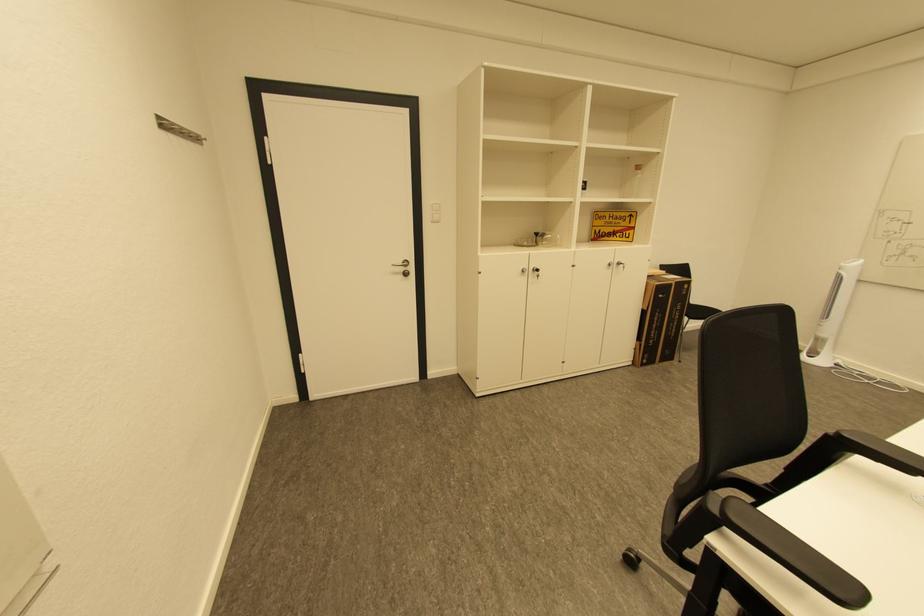
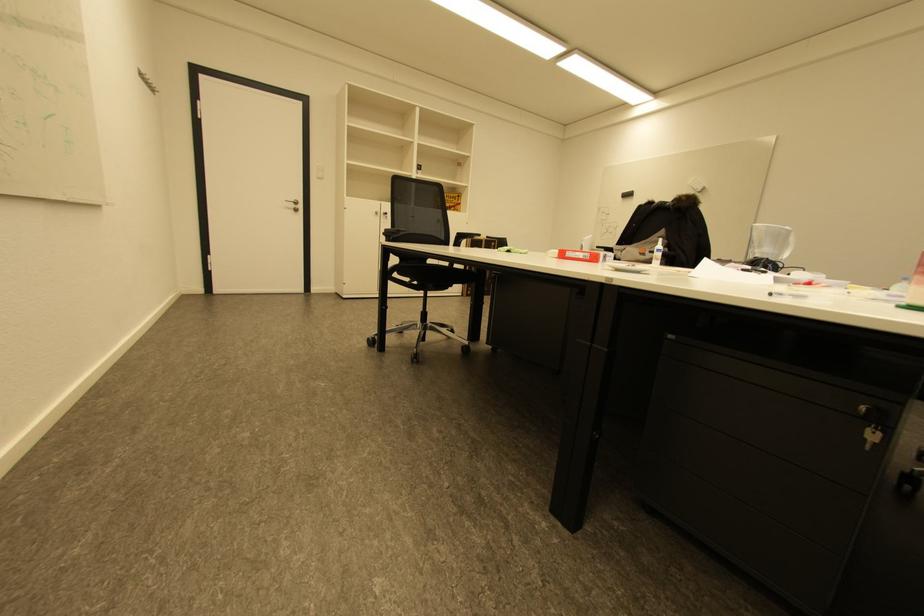
In the scene shown: What movement of the cameraman would produce the second image?

The cameraman moved toward right, backward.